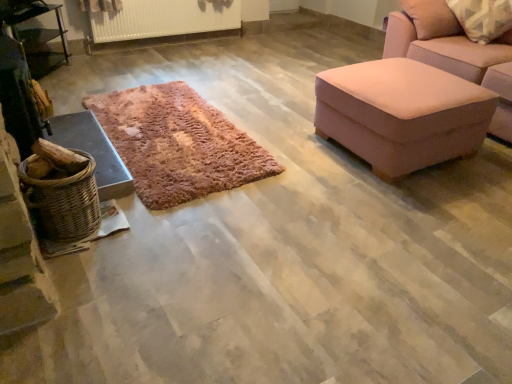
Question: Is metallic silver table at left positioned behind woven brown basket at left?

Choices:
 (A) no
 (B) yes

Answer: (B)

Question: Is metallic silver table at left next to woven brown basket at left and touching it?

Choices:
 (A) yes
 (B) no

Answer: (B)

Question: Does metallic silver table at left turn towards woven brown basket at left?

Choices:
 (A) no
 (B) yes

Answer: (A)

Question: Is metallic silver table at left to the left of woven brown basket at left from the viewer's perspective?

Choices:
 (A) no
 (B) yes

Answer: (B)

Question: Is woven brown basket at left surrounded by metallic silver table at left?

Choices:
 (A) no
 (B) yes

Answer: (A)

Question: Is woven wood basket at left in front of or behind woven brown basket at left in the image?

Choices:
 (A) behind
 (B) front

Answer: (A)

Question: From the image's perspective, is woven wood basket at left located above or below woven brown basket at left?

Choices:
 (A) below
 (B) above

Answer: (B)

Question: From a real-world perspective, is woven wood basket at left positioned above or below woven brown basket at left?

Choices:
 (A) above
 (B) below

Answer: (B)

Question: Is woven wood basket at left to the left or to the right of woven brown basket at left in the image?

Choices:
 (A) left
 (B) right

Answer: (A)

Question: From the image's perspective, relative to woven wood basket at left, is woven brown basket at left above or below?

Choices:
 (A) above
 (B) below

Answer: (B)

Question: Is woven brown basket at left inside or outside of woven wood basket at left?

Choices:
 (A) inside
 (B) outside

Answer: (B)

Question: Is point (79, 188) positioned closer to the camera than point (100, 153)?

Choices:
 (A) closer
 (B) farther

Answer: (A)

Question: Is woven brown basket at left to the left or to the right of woven wood basket at left in the image?

Choices:
 (A) left
 (B) right

Answer: (B)

Question: Would you say metallic silver table at left is to the left or to the right of woven wood basket at left in the picture?

Choices:
 (A) left
 (B) right

Answer: (A)

Question: Does point (31, 46) appear closer or farther from the camera than point (122, 193)?

Choices:
 (A) closer
 (B) farther

Answer: (B)